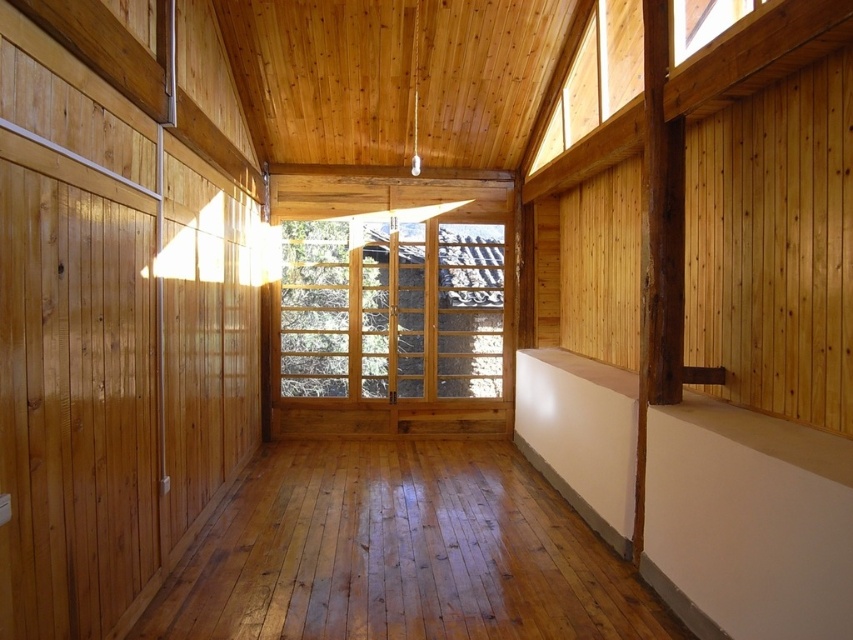
Question: Among these points, which one is nearest to the camera?

Choices:
 (A) (374, 369)
 (B) (686, 22)

Answer: (B)

Question: Can you confirm if clear glass window at center is bigger than clear glass window at upper right?

Choices:
 (A) yes
 (B) no

Answer: (A)

Question: Does clear glass window at center have a greater width compared to clear glass window at upper right?

Choices:
 (A) no
 (B) yes

Answer: (B)

Question: From the image, what is the correct spatial relationship of clear glass window at center in relation to clear glass window at upper right?

Choices:
 (A) below
 (B) above

Answer: (A)